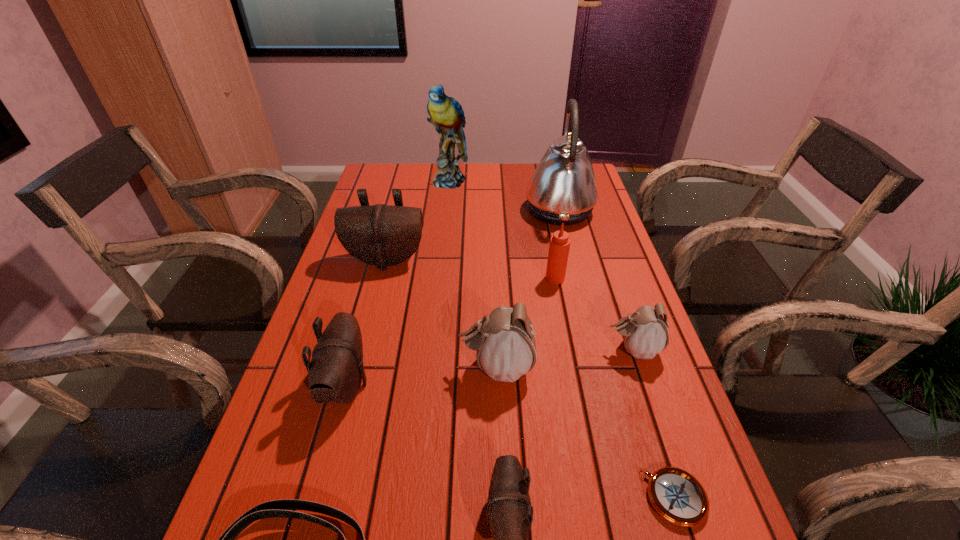
The image size is (960, 540). Identify the location of the fourth closest pouch relative to the parrot. (645, 334).

Locate an element on the screen. This screenshot has height=540, width=960. the third closest pouch to the nearest pouch is located at coordinates (645, 334).

The height and width of the screenshot is (540, 960). Find the location of `brown pouch that stands as the second closest to the dog collar`. brown pouch that stands as the second closest to the dog collar is located at coordinates (508, 505).

Select which brown pouch appears as the second closest to the kettle. Please provide its 2D coordinates. Your answer should be formatted as a tuple, i.e. [(x, y)], where the tuple contains the x and y coordinates of a point satisfying the conditions above.

[(336, 371)]

I want to click on free spot that satisfies the following two spatial constraints: 1. on the front side of the kettle; 2. with the flap open on the second smallest brown pouch, so click(x=603, y=385).

Where is `blank space that satisfies the following two spatial constraints: 1. on the face of the parrot; 2. on the right side of the compass`? This screenshot has height=540, width=960. blank space that satisfies the following two spatial constraints: 1. on the face of the parrot; 2. on the right side of the compass is located at coordinates (415, 498).

Identify the location of vacant area in the image that satisfies the following two spatial constraints: 1. on the face of the parrot; 2. with the flap open on the second farthest brown pouch. The width and height of the screenshot is (960, 540). (427, 385).